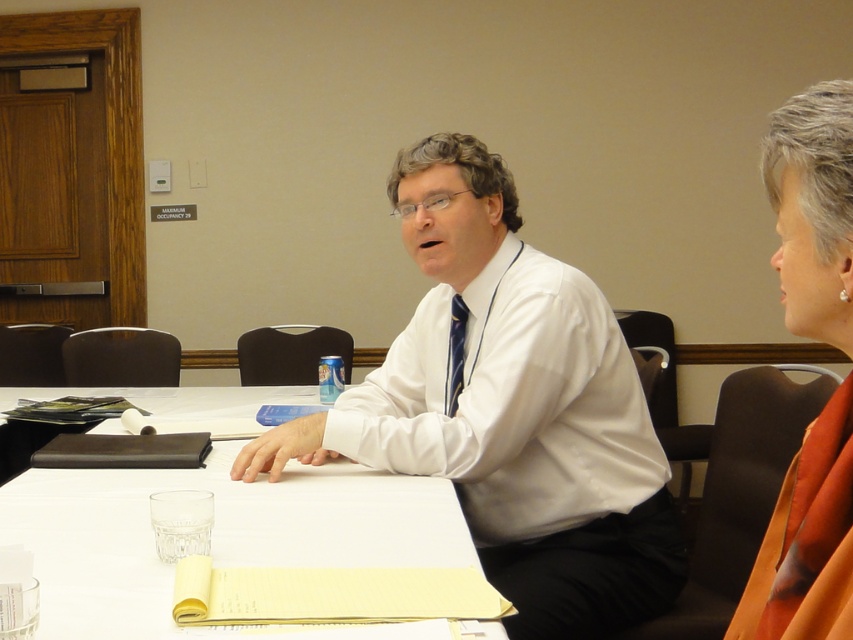
Question: Among these points, which one is nearest to the camera?

Choices:
 (A) (479, 243)
 (B) (456, 396)

Answer: (A)

Question: In this image, where is white smooth dress shirt at center located relative to orange fabric scarf at upper right?

Choices:
 (A) above
 (B) below

Answer: (B)

Question: Estimate the real-world distances between objects in this image. Which object is closer to the blue striped tie at center?

Choices:
 (A) white paper at center
 (B) white smooth dress shirt at center
 (C) orange fabric scarf at upper right

Answer: (B)

Question: Observing the image, what is the correct spatial positioning of white smooth dress shirt at center in reference to white paper at center?

Choices:
 (A) above
 (B) below

Answer: (A)

Question: Does white glossy shirt at center appear over orange fabric scarf at upper right?

Choices:
 (A) yes
 (B) no

Answer: (B)

Question: Which of the following is the closest to the observer?

Choices:
 (A) (463, 358)
 (B) (476, 401)
 (C) (625, 458)

Answer: (B)